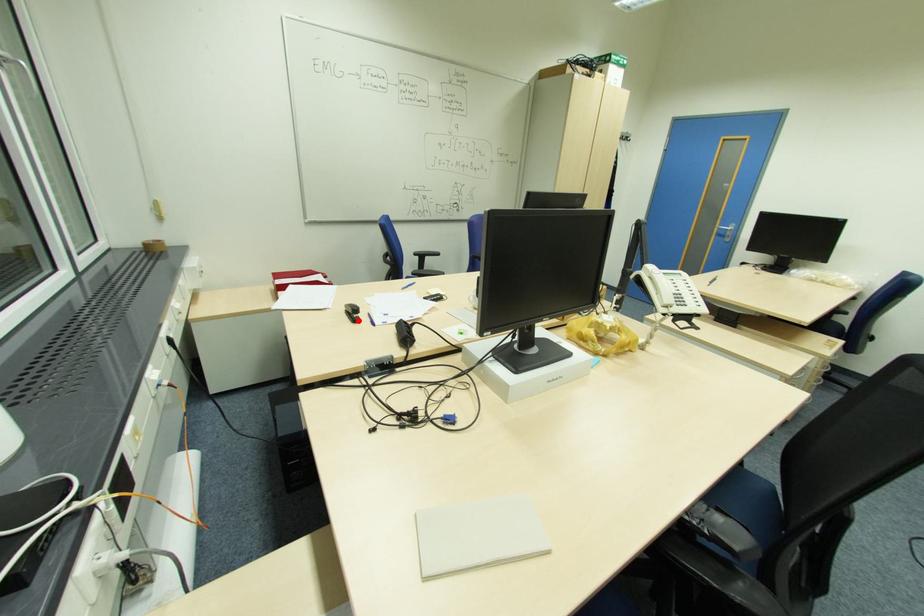
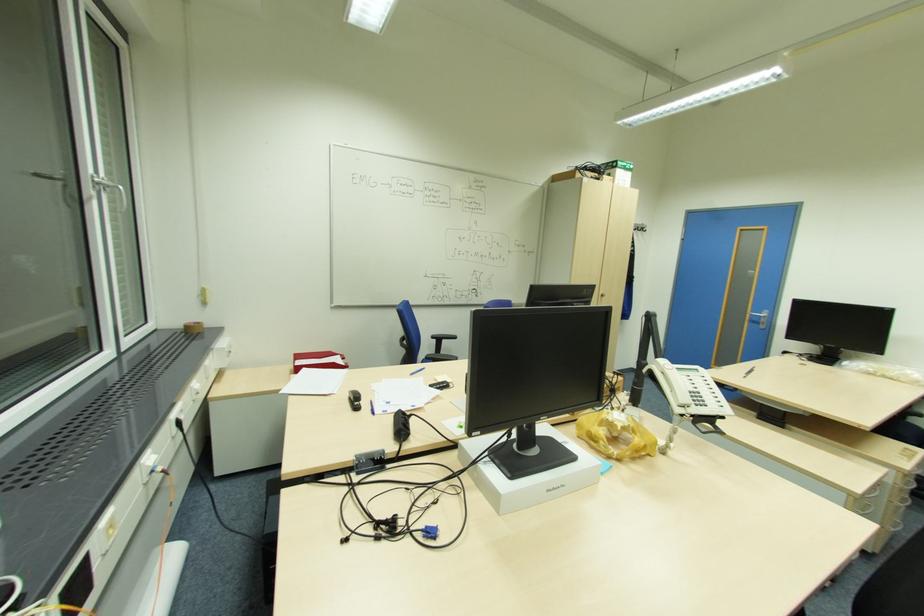
Where in the second image is the point corresponding to the highlighted location from the first image?

(359, 408)